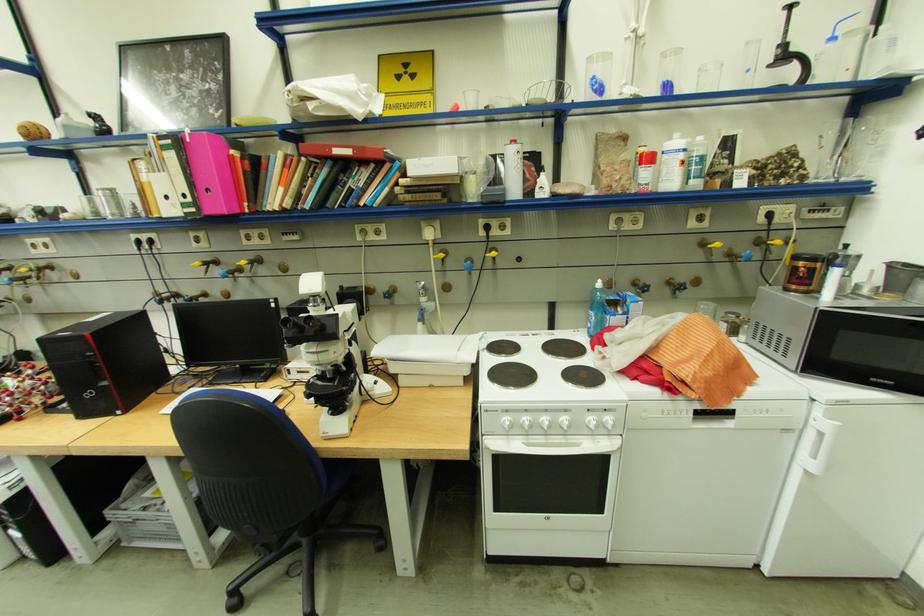
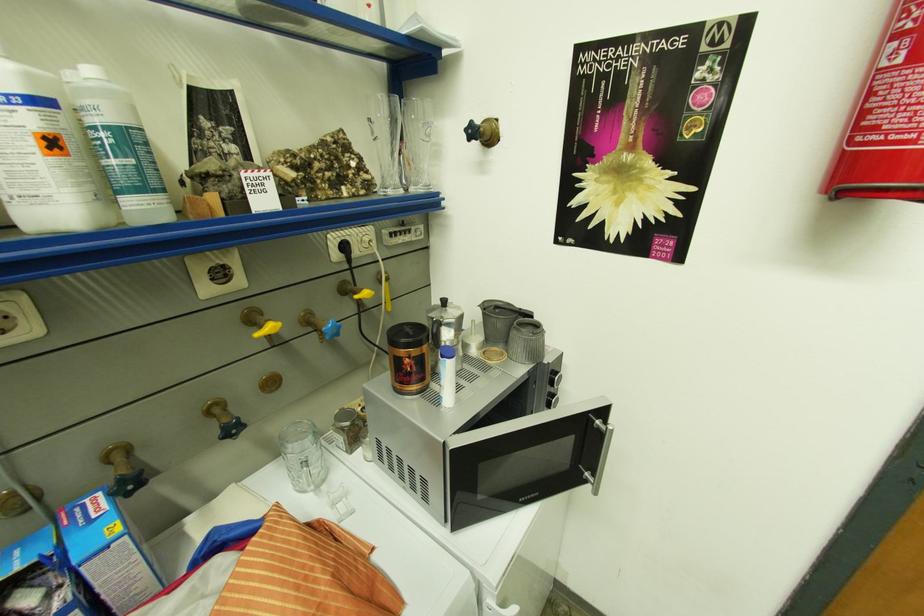
The point at (822, 176) is marked in the first image. Where is the corresponding point in the second image?

(387, 182)